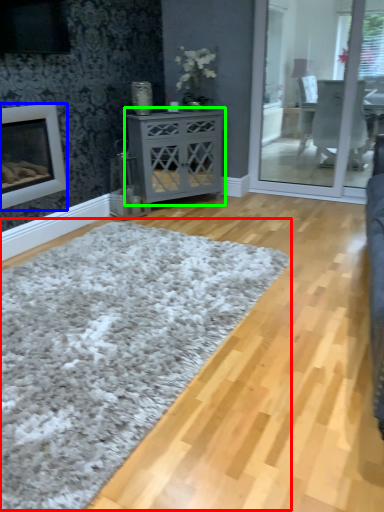
Question: Which object is positioned closest to plain (highlighted by a red box)? Select from fireplace (highlighted by a blue box) and nightstand (highlighted by a green box).

Choices:
 (A) fireplace
 (B) nightstand

Answer: (A)